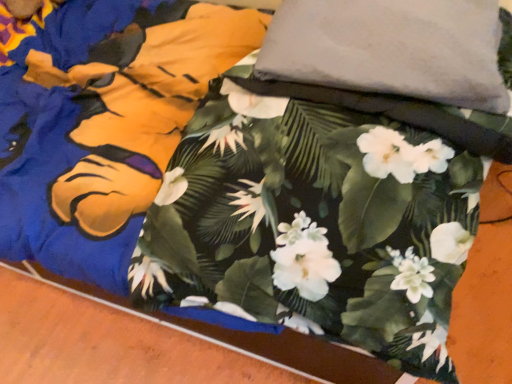
What are the coordinates of `gray fabric pillow at upper center` in the screenshot? It's located at (390, 49).

Consider the image. What is the approximate height of gray fabric pillow at upper center?

gray fabric pillow at upper center is 12.42 centimeters in height.

What do you see at coordinates (390, 49) in the screenshot?
I see `gray fabric pillow at upper center` at bounding box center [390, 49].

Identify the location of gray fabric pillow at upper center. This screenshot has height=384, width=512. (390, 49).